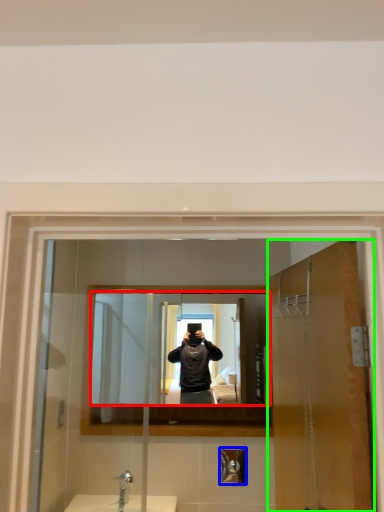
Question: Which object is the farthest from mirror (highlighted by a red box)? Choose among these: shower (highlighted by a blue box) or door (highlighted by a green box).

Choices:
 (A) shower
 (B) door

Answer: (B)